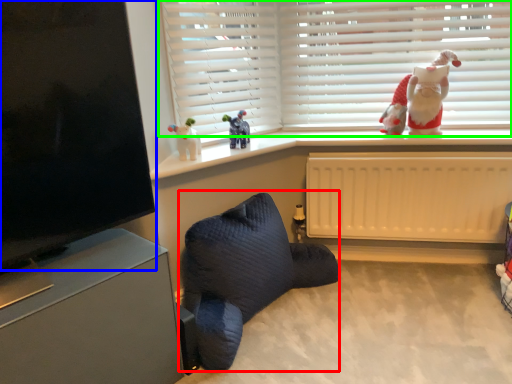
Question: Based on their relative distances, which object is farther from bean bag chair (highlighted by a red box)? Choose from window screen (highlighted by a blue box) and window blind (highlighted by a green box).

Choices:
 (A) window screen
 (B) window blind

Answer: (B)